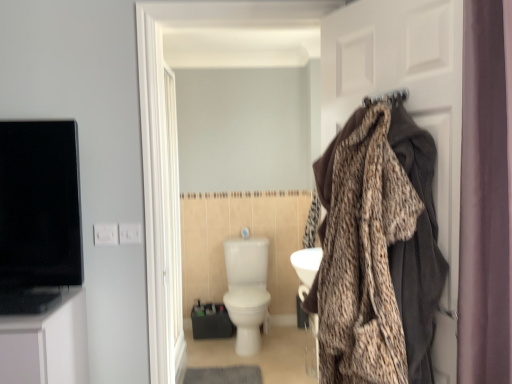
Question: From the image's perspective, is leopard print blanket at right located above or below white glossy toilet at center?

Choices:
 (A) below
 (B) above

Answer: (B)

Question: In the image, is leopard print blanket at right on the left side or the right side of white glossy toilet at center?

Choices:
 (A) right
 (B) left

Answer: (A)

Question: Estimate the real-world distances between objects in this image. Which object is closer to the brown fabric coat at right?

Choices:
 (A) white glossy door at center
 (B) leopard print blanket at right
 (C) purple fabric curtain at right
 (D) white glossy toilet at center

Answer: (B)

Question: Considering the real-world distances, which object is closest to the leopard print blanket at right?

Choices:
 (A) brown fabric coat at right
 (B) white glossy door at center
 (C) white glossy toilet at center
 (D) purple fabric curtain at right

Answer: (A)